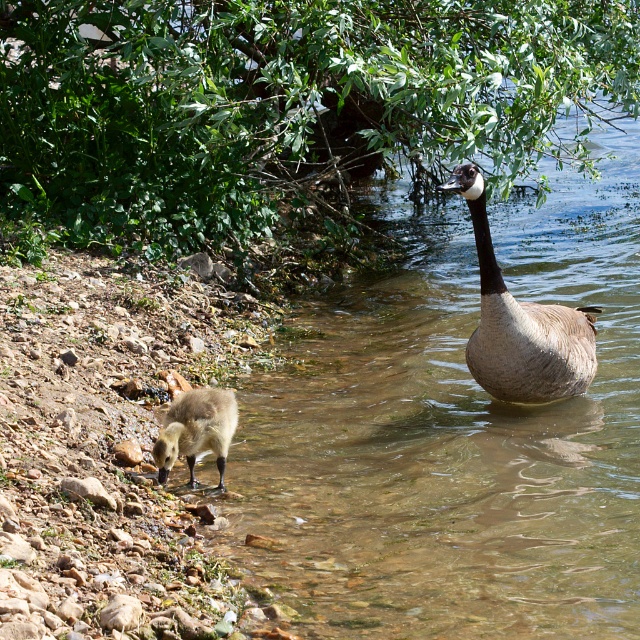
Does clear water at goose right lie in front of brown fuzzy duckling at lower left?

No.

Is clear water at goose right further to camera compared to brown fuzzy duckling at lower left?

Yes, it is behind brown fuzzy duckling at lower left.

Who is more distant from viewer, (392, 346) or (216, 456)?

The point (392, 346) is more distant.

Where is `clear water at goose right`? The height and width of the screenshot is (640, 640). clear water at goose right is located at coordinates (452, 435).

Does brown feathered goose at right have a lesser width compared to brown fuzzy duckling at lower left?

In fact, brown feathered goose at right might be wider than brown fuzzy duckling at lower left.

Is brown feathered goose at right smaller than brown fuzzy duckling at lower left?

Actually, brown feathered goose at right might be larger than brown fuzzy duckling at lower left.

Does point (579, 384) come in front of point (227, 412)?

No, (579, 384) is behind (227, 412).

Image resolution: width=640 pixels, height=640 pixels. In order to click on brown feathered goose at right in this screenshot , I will do `click(520, 324)`.

Can you confirm if clear water at goose right is positioned below brown feathered goose at right?

Yes, clear water at goose right is below brown feathered goose at right.

In order to click on clear water at goose right in this screenshot , I will do `click(452, 435)`.